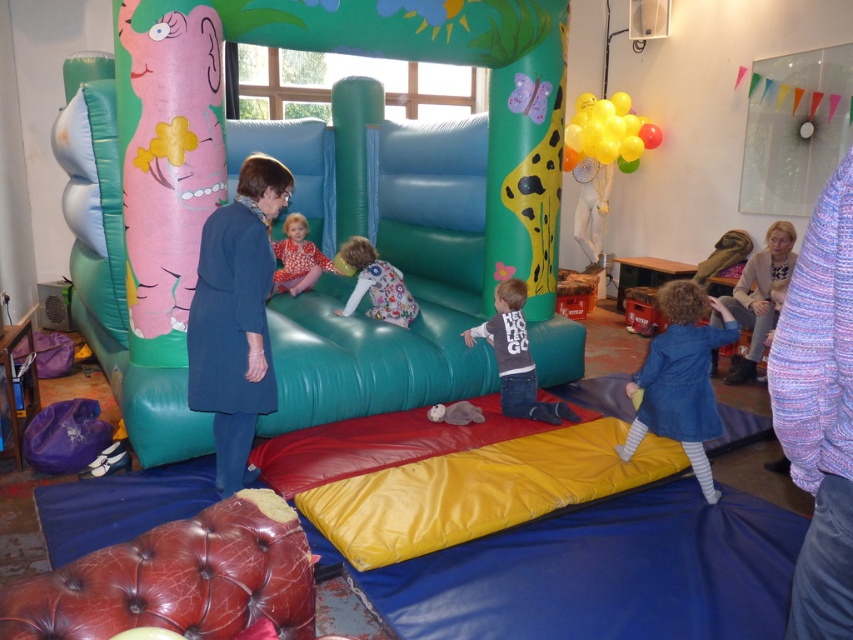
Question: Which point is closer to the camera?

Choices:
 (A) knitted sweater at right
 (B) denim dress at lower right
 (C) matte pink dress at center
 (D) yellow rubber balloons at upper right

Answer: (B)

Question: Which is nearer to the blue fabric coat at center?

Choices:
 (A) matte pink dress at center
 (B) fuzzy gray stuffed animal at center
 (C) green inflatable slide at center

Answer: (B)

Question: Can you confirm if blue fabric coat at center is bigger than knitted sweater at right?

Choices:
 (A) no
 (B) yes

Answer: (A)

Question: Is green inflatable slide at center to the right of denim dress at lower right from the viewer's perspective?

Choices:
 (A) no
 (B) yes

Answer: (A)

Question: Is knitted sweater at right positioned before fuzzy gray stuffed animal at center?

Choices:
 (A) yes
 (B) no

Answer: (B)

Question: Which point is closer to the camera?

Choices:
 (A) knitted sweater at right
 (B) yellow rubber balloons at upper right
 (C) blue fabric coat at center

Answer: (C)